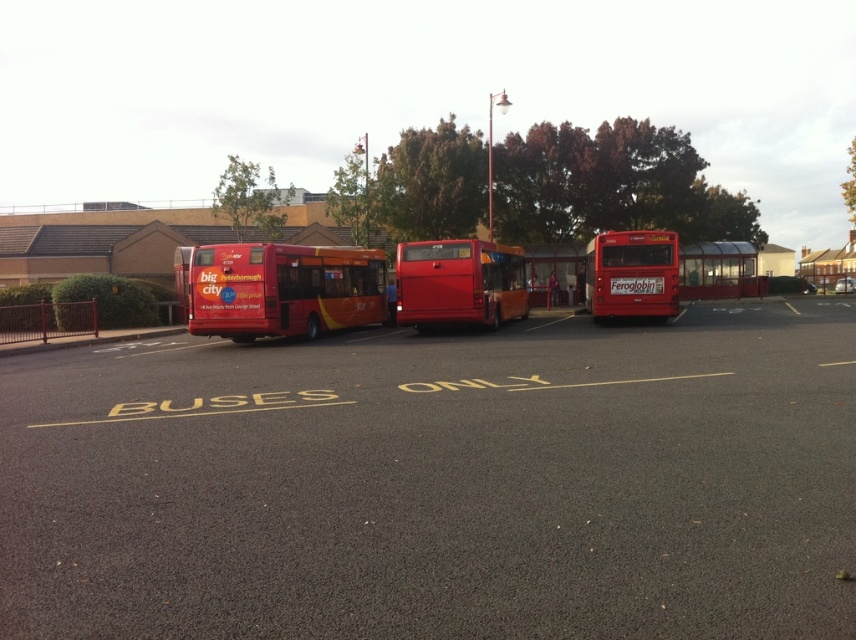
Question: Estimate the real-world distances between objects in this image. Which object is closer to the matte red bus at center?

Choices:
 (A) matte red bus at right
 (B) metallic red bus stop at center

Answer: (A)

Question: Is matte red bus at center to the left of shiny red bus at center from the viewer's perspective?

Choices:
 (A) yes
 (B) no

Answer: (A)

Question: Which of the following is the farthest from the observer?

Choices:
 (A) metallic red bus stop at center
 (B) matte red bus at left

Answer: (A)

Question: Can you confirm if metallic red bus stop at center is positioned to the left of matte red bus at left?

Choices:
 (A) yes
 (B) no

Answer: (B)

Question: Which is nearer to the shiny red bus at center?

Choices:
 (A) matte red bus at left
 (B) smooth asphalt parking lot at center
 (C) metallic red bus stop at center
 (D) matte red bus at center

Answer: (D)

Question: Does matte red bus at right come in front of matte red bus at left?

Choices:
 (A) no
 (B) yes

Answer: (B)